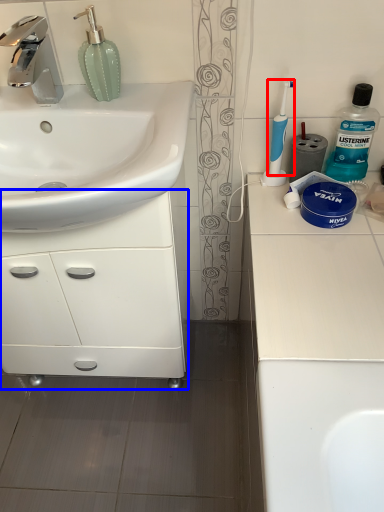
Question: Which of the following is the closest to the observer, toothbrush (highlighted by a red box) or bathroom cabinet (highlighted by a blue box)?

Choices:
 (A) toothbrush
 (B) bathroom cabinet

Answer: (B)